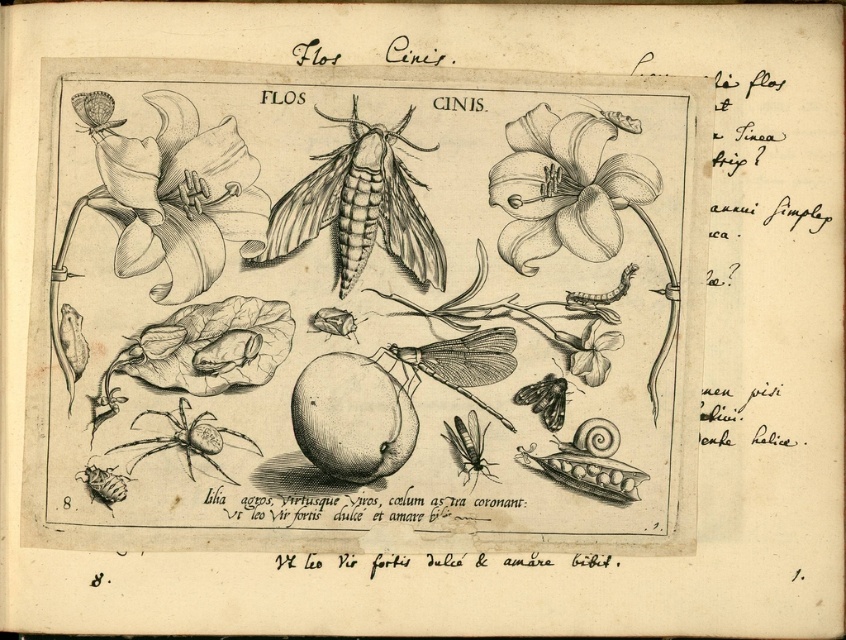
Consider the image. Based on the botanical illustration described, which object is taller between the matte black lily at upper left and the translucent winged insect at center?

The matte black lily at upper left is taller than the translucent winged insect at center according to the description.